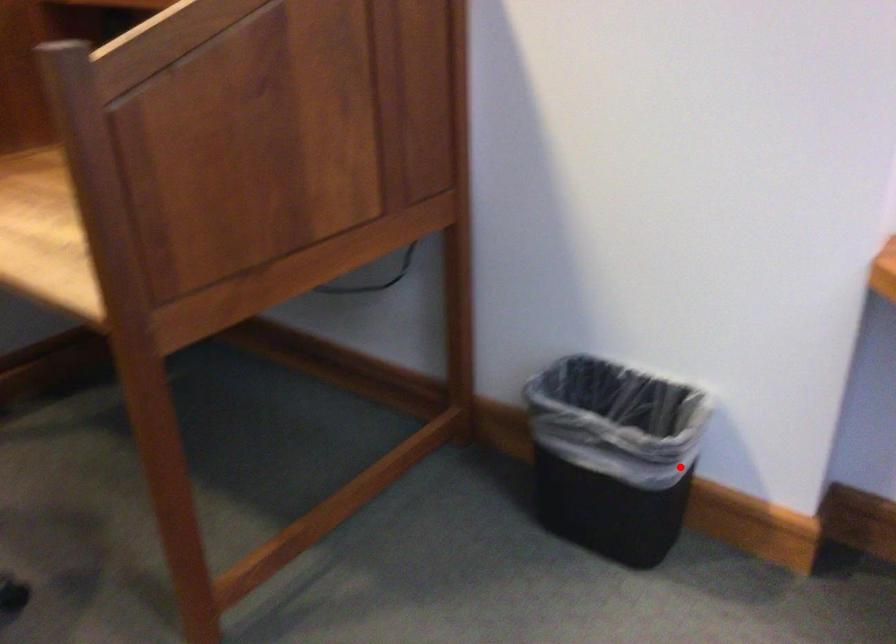
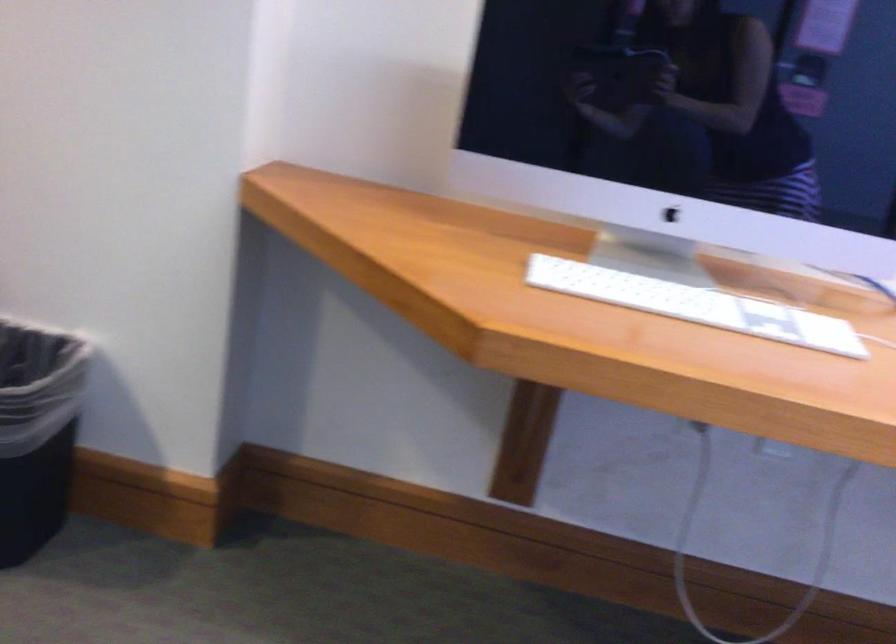
Question: I am providing you with two images of the same scene from different viewpoints. A red point is marked on the first image. Is the red point's position out of view in image 2?

Choices:
 (A) Yes
 (B) No

Answer: (B)